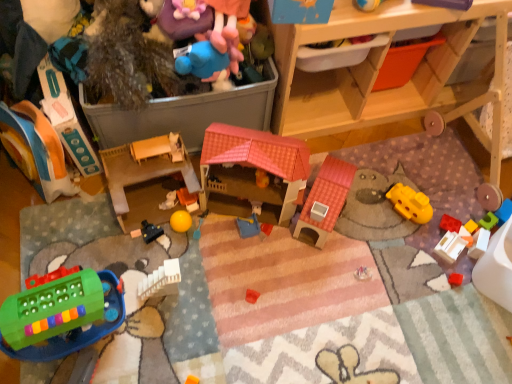
The image size is (512, 384). In order to click on empty space that is in between yellow rubber ball at center, arranged as the 8th toy when viewed from the right, and blue plastic toy at center, which is the fifth toy from right to left in this screenshot , I will do `click(212, 230)`.